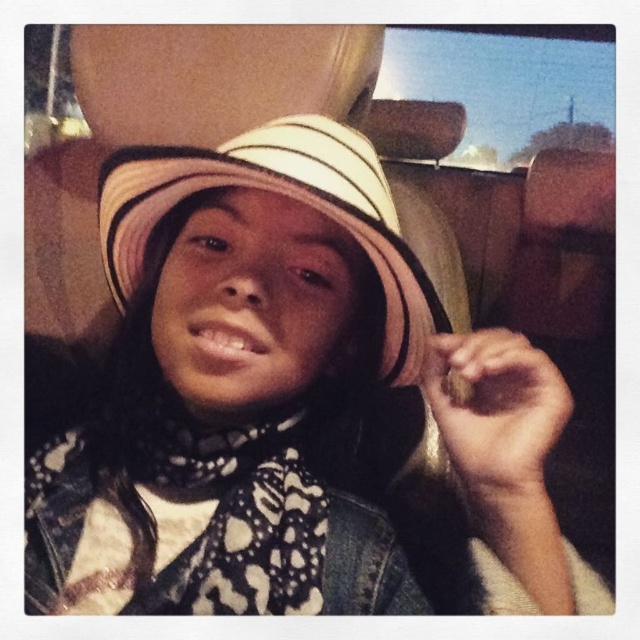
You are a fashion designer observing a person wearing a white striped hat at center and a black printed scarf at center. Which item is located to the right of the other?

The white striped hat at center is positioned on the right side of black printed scarf at center.

You are sitting in a moving car and notice two points inside the vehicle. The first point is at coordinates point [305,145] and the second is at point [248,531]. Which point is closer to you?

Point [305,145] is closer to the viewer than point [248,531].

You are an interior designer assessing the interior space of a moving vehicle. You notice the black printed scarf at center and the white striped fabric hat at center. Which object takes up more space in the scene?

The white striped fabric hat at center takes up more space than the black printed scarf at center.